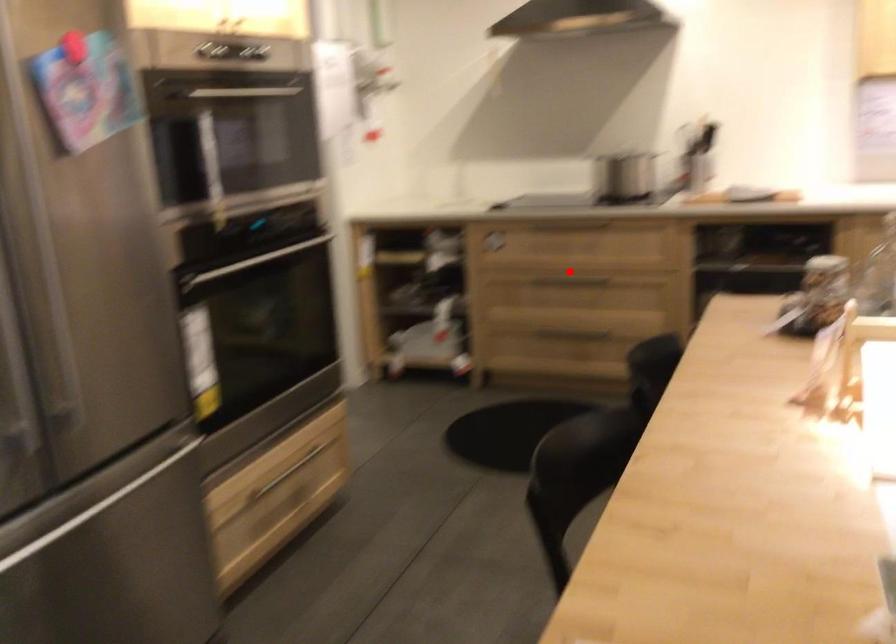
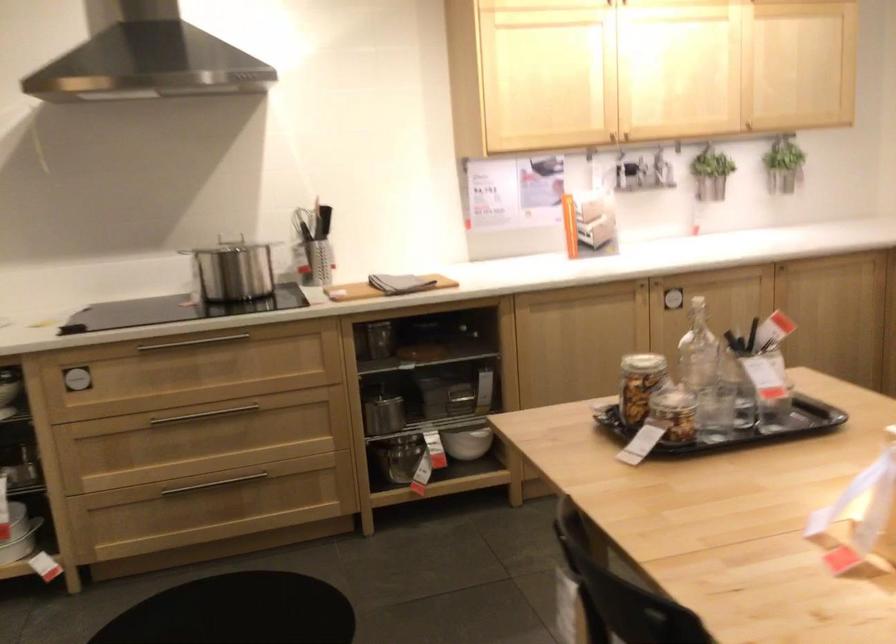
Where in the second image is the point corresponding to the highlighted location from the first image?

(200, 415)